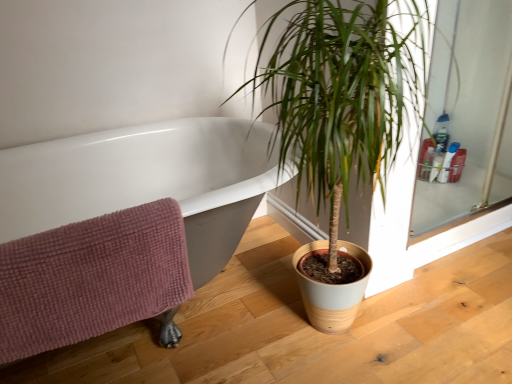
Locate an element on the screen. The height and width of the screenshot is (384, 512). vacant area that is in front of translucent plastic bottles at upper right, arranged as the 1th toiletry when viewed from the left is located at coordinates (439, 193).